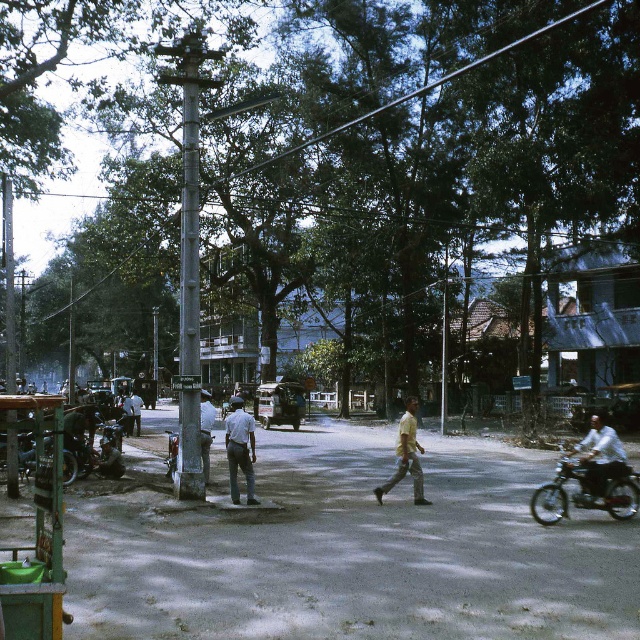
You are a photographer positioned at the center of the road. You want to take a photo that includes both the white textured shirt at right and the shiny chrome motorcycle at lower left. Which object should you move closer to in order to have both in focus?

To have both the white textured shirt at right and the shiny chrome motorcycle at lower left in focus, you should move closer to the shiny chrome motorcycle at lower left since the white textured shirt at right is in front of it, requiring a smaller depth of field adjustment.

You are a photographer standing in the middle of the street. You want to take a photo that includes both the white textured shirt at right and the shiny chrome motorcycle at lower left. Which object should you pan your camera towards first to ensure both are in frame?

You should pan your camera towards the shiny chrome motorcycle at lower left first because the white textured shirt at right is positioned on the right side of it, so starting from the motorcycle and panning right will capture both objects in the frame.

You are a photographer standing on the sidewalk. You want to take a photo of the smooth gray pole at center without any people in the frame. Is the white textured shirt at right blocking your view of the pole?

The white textured shirt at right is behind the smooth gray pole at center, so it won not block your view of the pole.